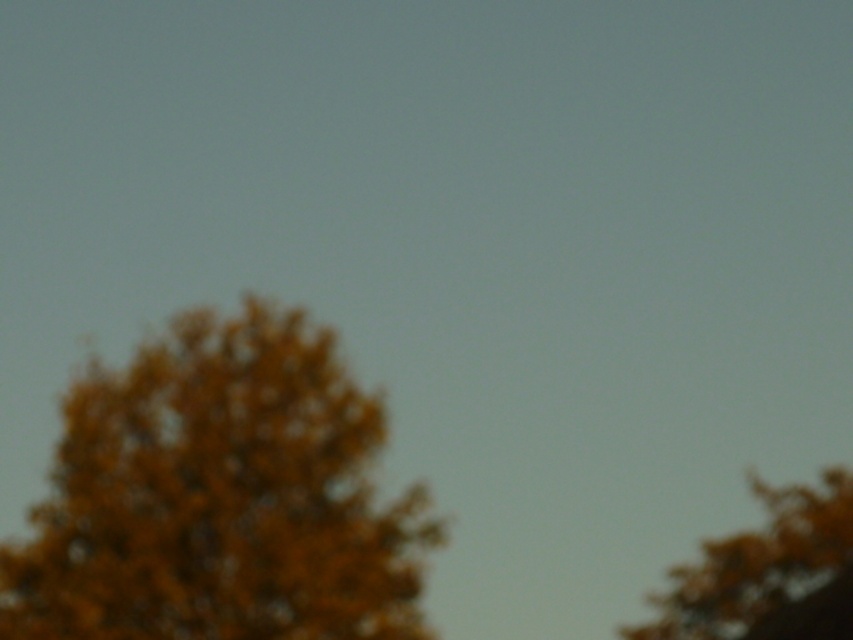
You are a bird looking for a place to perch. You see an orange fuzzy tree at left and golden textured leaves at upper right. Which tree is taller and would provide a higher perch?

The orange fuzzy tree at left is much taller than golden textured leaves at upper right, so it would provide a higher perch.

You are standing in a park and see a point marked at coordinates (219, 499). Based on the scene description, what object is located at that point?

The point at coordinates (219, 499) corresponds to the orange fuzzy tree at left.